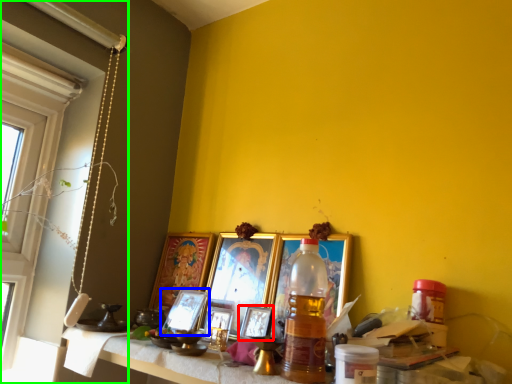
Question: Which is farther away from picture frame (highlighted by a red box)? picture frame (highlighted by a blue box) or window (highlighted by a green box)?

Choices:
 (A) picture frame
 (B) window

Answer: (B)